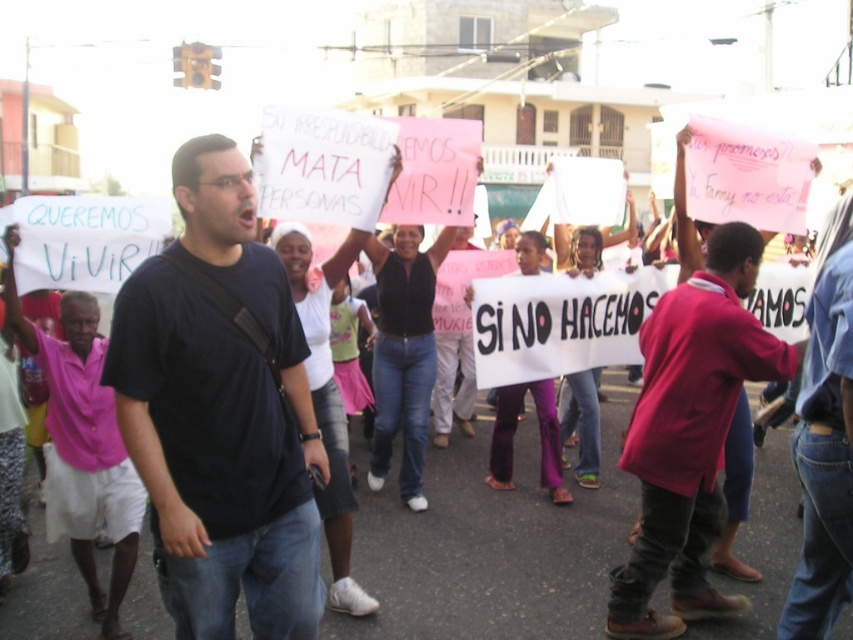
Question: Does dark blue t-shirt at center have a smaller size compared to red cotton shirt at center?

Choices:
 (A) yes
 (B) no

Answer: (A)

Question: Which point is farther to the camera?

Choices:
 (A) red cotton shirt at center
 (B) dark blue t-shirt at center

Answer: (A)

Question: Does dark blue t-shirt at center appear over red cotton shirt at center?

Choices:
 (A) yes
 (B) no

Answer: (A)

Question: Is dark blue t-shirt at center bigger than red cotton shirt at center?

Choices:
 (A) no
 (B) yes

Answer: (A)